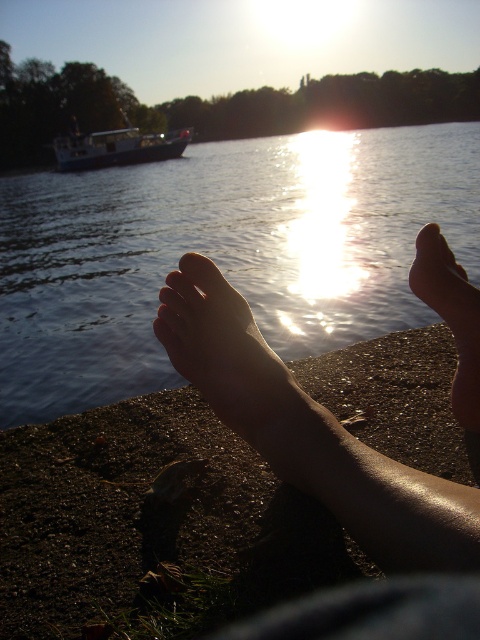
Question: Does skinny bare feet at center appear over smooth skin foot at lower right?

Choices:
 (A) no
 (B) yes

Answer: (A)

Question: Which object is positioned closest to the shiny blue water at center?

Choices:
 (A) skinny bare feet at center
 (B) smooth skin foot at lower right
 (C) matte skin toe at center
 (D) brown matte toe at center

Answer: (A)

Question: Which object is farther from the camera taking this photo?

Choices:
 (A) skinny bare feet at center
 (B) matte skin toe at center
 (C) brown matte toe at center

Answer: (B)

Question: Based on their relative distances, which object is nearer to the skinny bare feet at center?

Choices:
 (A) brown matte toe at center
 (B) matte skin toe at center
 (C) blue matte boat at upper left

Answer: (A)

Question: Does shiny blue water at center have a larger size compared to smooth skin foot at lower right?

Choices:
 (A) no
 (B) yes

Answer: (B)

Question: Observing the image, what is the correct spatial positioning of smooth skin foot at lower right in reference to brown matte toe at center?

Choices:
 (A) below
 (B) above

Answer: (A)